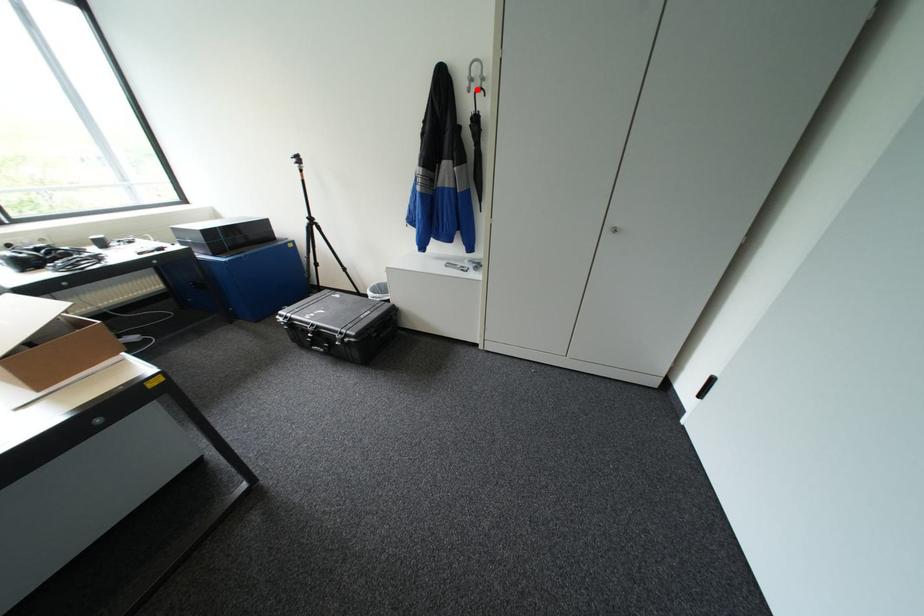
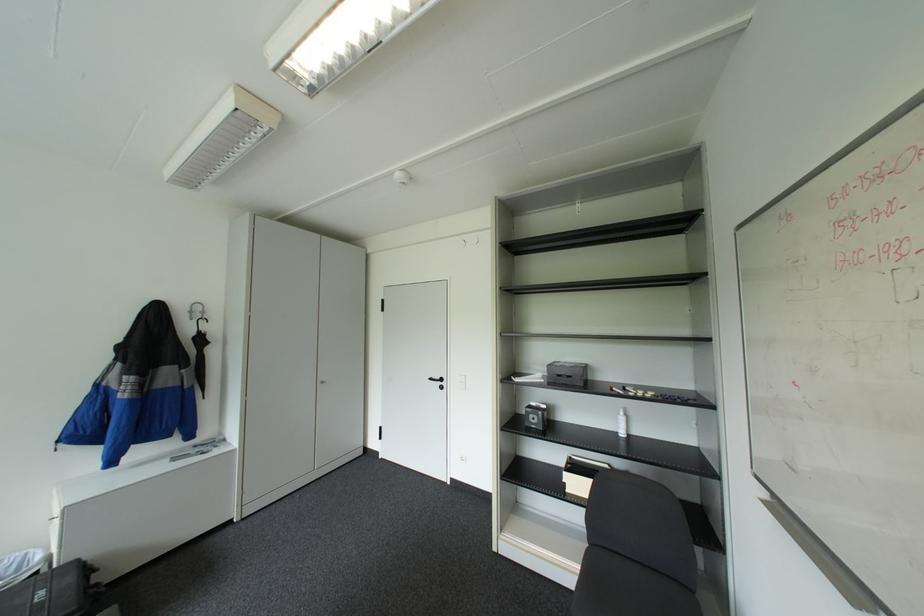
Where in the second image is the point corresponding to the highlighted location from the first image?

(200, 318)